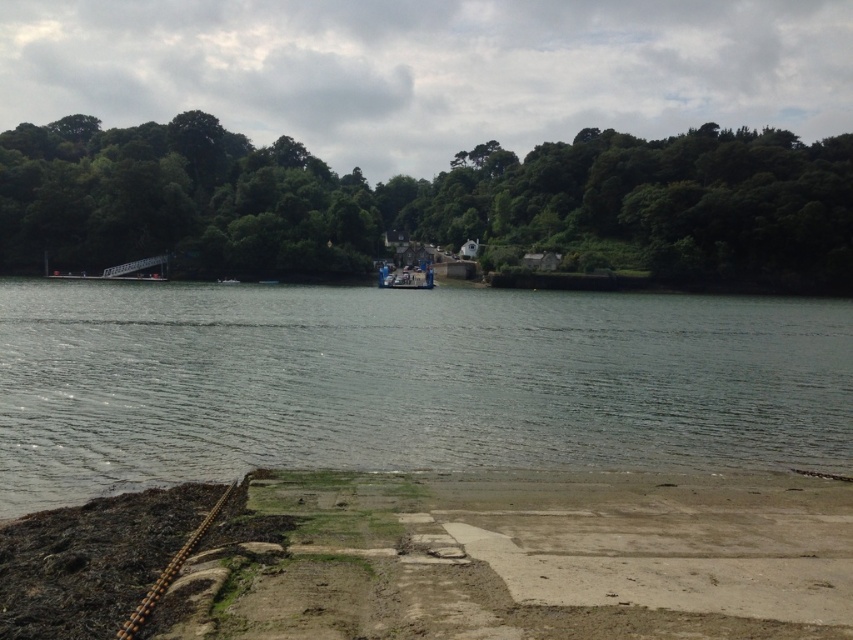
Between green leafy trees at center and metallic blue boat at center, which one appears on the right side from the viewer's perspective?

metallic blue boat at center is more to the right.

Between point (341, 208) and point (393, 275), which one is positioned in front?

Point (393, 275) is in front.

The width and height of the screenshot is (853, 640). Find the location of `green leafy trees at center`. green leafy trees at center is located at coordinates (x=428, y=202).

The height and width of the screenshot is (640, 853). What do you see at coordinates (405, 381) in the screenshot?
I see `greenish-gray water at center` at bounding box center [405, 381].

Is point (7, 506) less distant than point (399, 282)?

Yes, point (7, 506) is in front of point (399, 282).

The width and height of the screenshot is (853, 640). I want to click on greenish-gray water at center, so click(x=405, y=381).

Which of these two, dull concrete pier at lower center or metallic blue boat at center, stands taller?

metallic blue boat at center is taller.

Is dull concrete pier at lower center positioned behind metallic blue boat at center?

No.

Is point (228, 586) closer to camera compared to point (412, 269)?

Yes, it is.

Image resolution: width=853 pixels, height=640 pixels. I want to click on dull concrete pier at lower center, so click(515, 557).